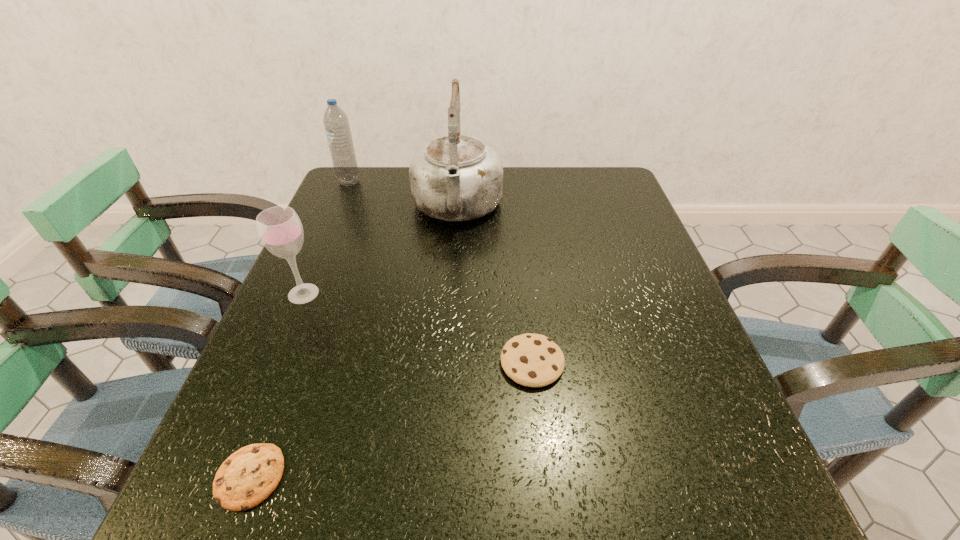
This screenshot has height=540, width=960. Identify the location of vacant space situated 0.200m on the right of the wineglass. pos(416,294).

Locate an element on the screen. The image size is (960, 540). vacant region located on the back of the fourth farthest object is located at coordinates (527, 316).

This screenshot has height=540, width=960. I want to click on free space located on the right of the nearest object, so click(357, 477).

The width and height of the screenshot is (960, 540). Find the location of `kettle located in the far edge section of the desktop`. kettle located in the far edge section of the desktop is located at coordinates (454, 178).

This screenshot has height=540, width=960. What are the coordinates of `water bottle at the far edge` in the screenshot? It's located at (336, 123).

I want to click on object positioned at the near edge, so click(x=247, y=477).

Find the location of a particular element. The width and height of the screenshot is (960, 540). water bottle that is positioned at the left edge is located at coordinates (336, 123).

What are the coordinates of `wineglass situated at the left edge` in the screenshot? It's located at (280, 230).

Find the location of a particular element. The image size is (960, 540). cookie present at the left edge is located at coordinates (247, 477).

Identify the location of object situated at the far left corner. This screenshot has width=960, height=540. (336, 123).